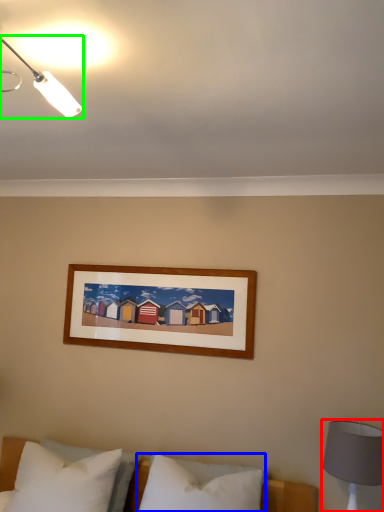
Question: Which is nearer to the bedside lamp (highlighted by a red box)? pillow (highlighted by a blue box) or lamp (highlighted by a green box).

Choices:
 (A) pillow
 (B) lamp

Answer: (A)